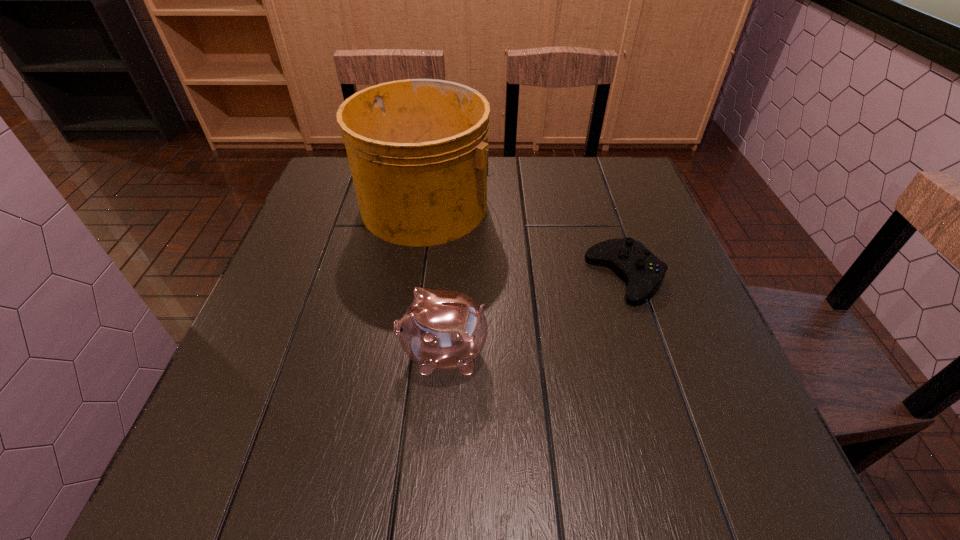
Where is `vacant space located 0.280m on the back of the control`? This screenshot has width=960, height=540. vacant space located 0.280m on the back of the control is located at coordinates (595, 184).

Identify the location of object present at the far edge. pos(418,149).

Where is `object positioned at the left edge`? object positioned at the left edge is located at coordinates (418, 149).

You are a GUI agent. You are given a task and a screenshot of the screen. Output one action in this format:
    pyautogui.click(x=<x>, y=<y>)
    Task: Click on the object that is positioned at the right edge
    The width and height of the screenshot is (960, 540).
    Given the screenshot: What is the action you would take?
    pyautogui.click(x=640, y=267)

This screenshot has width=960, height=540. What are the coordinates of `object that is positioned at the far left corner` in the screenshot? It's located at (418, 149).

Find the location of a particular element. vacant space at the far edge is located at coordinates (570, 177).

This screenshot has height=540, width=960. What are the coordinates of `vacant space at the near edge of the desktop` in the screenshot? It's located at (316, 493).

The width and height of the screenshot is (960, 540). In the image, there is a desktop. Identify the location of vacant region at the left edge. (320, 206).

Identify the location of vacant space at the right edge. (652, 207).

Where is `vacant region at the near left corner of the desktop`? The image size is (960, 540). vacant region at the near left corner of the desktop is located at coordinates (243, 489).